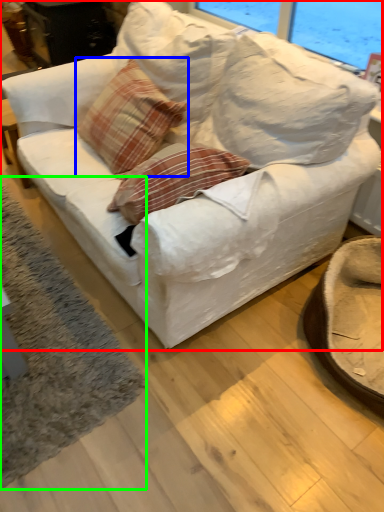
Question: Based on their relative distances, which object is nearer to studio couch (highlighted by a red box)? Choose from throw pillow (highlighted by a blue box) and mat (highlighted by a green box).

Choices:
 (A) throw pillow
 (B) mat

Answer: (A)